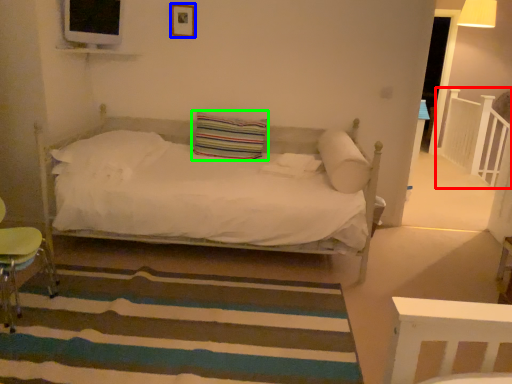
Question: Which object is the farthest from balustrade (highlighted by a red box)? Choose among these: picture frame (highlighted by a blue box) or pillow (highlighted by a green box).

Choices:
 (A) picture frame
 (B) pillow

Answer: (A)